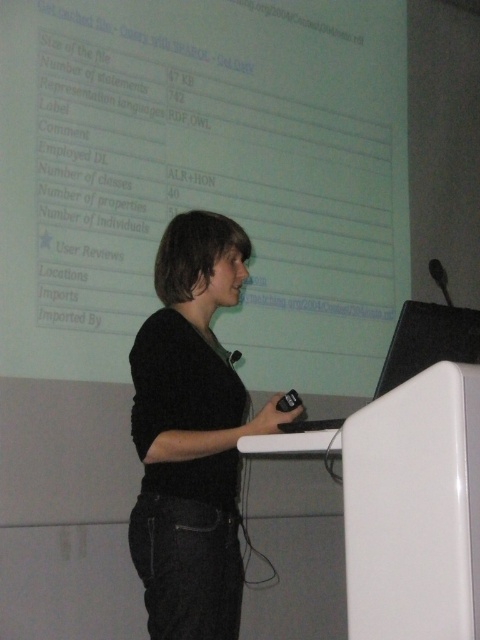
Question: Which object is farther from the camera taking this photo?

Choices:
 (A) white matte projection screen at upper center
 (B) black fuzzy sweater at center

Answer: (A)

Question: Can you confirm if white matte projection screen at upper center is smaller than black fuzzy sweater at center?

Choices:
 (A) no
 (B) yes

Answer: (A)

Question: Does white matte projection screen at upper center come behind black fuzzy sweater at center?

Choices:
 (A) no
 (B) yes

Answer: (B)

Question: Does white matte projection screen at upper center have a greater width compared to black fuzzy sweater at center?

Choices:
 (A) no
 (B) yes

Answer: (B)